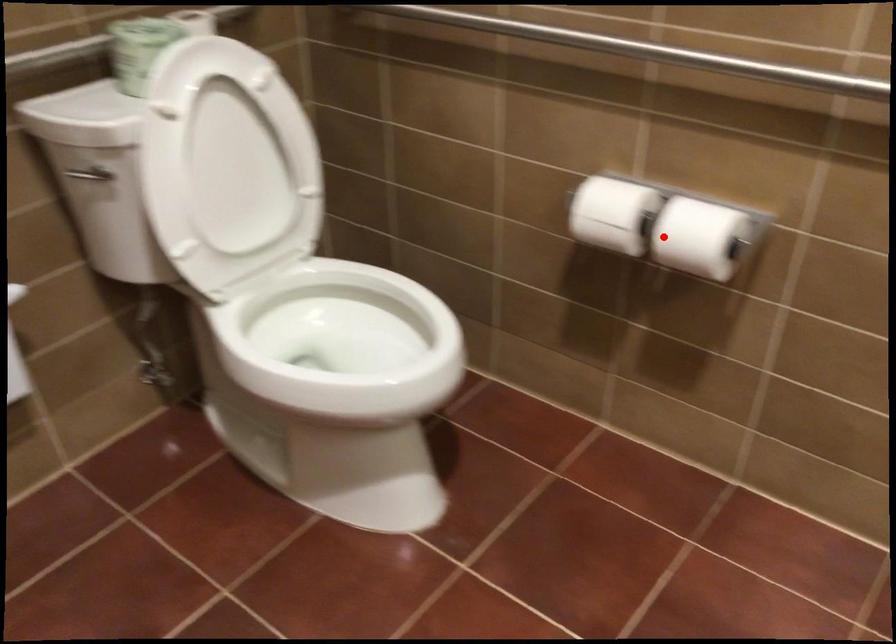
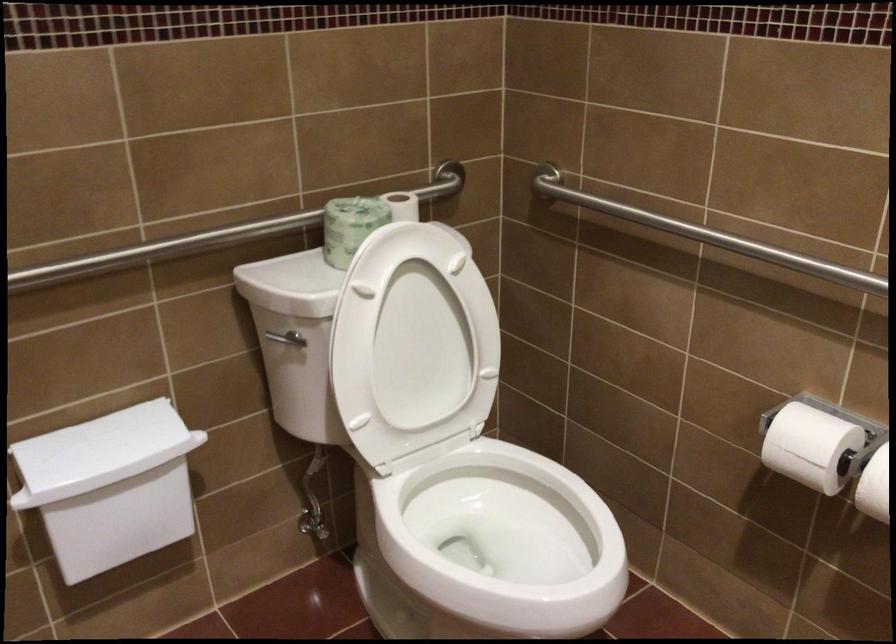
Where in the second image is the point corresponding to the highlighted location from the first image?

(874, 486)